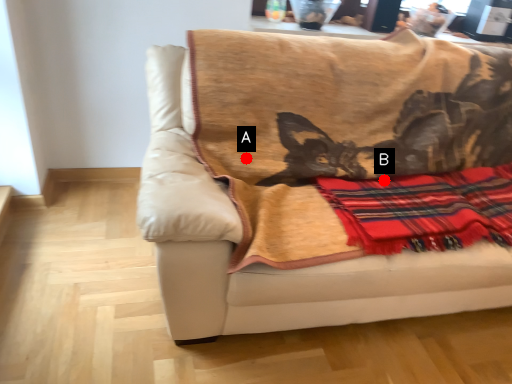
Question: Two points are circled on the image, labeled by A and B beside each circle. Which of the following is the farthest from the observer?

Choices:
 (A) A is further
 (B) B is further

Answer: (B)